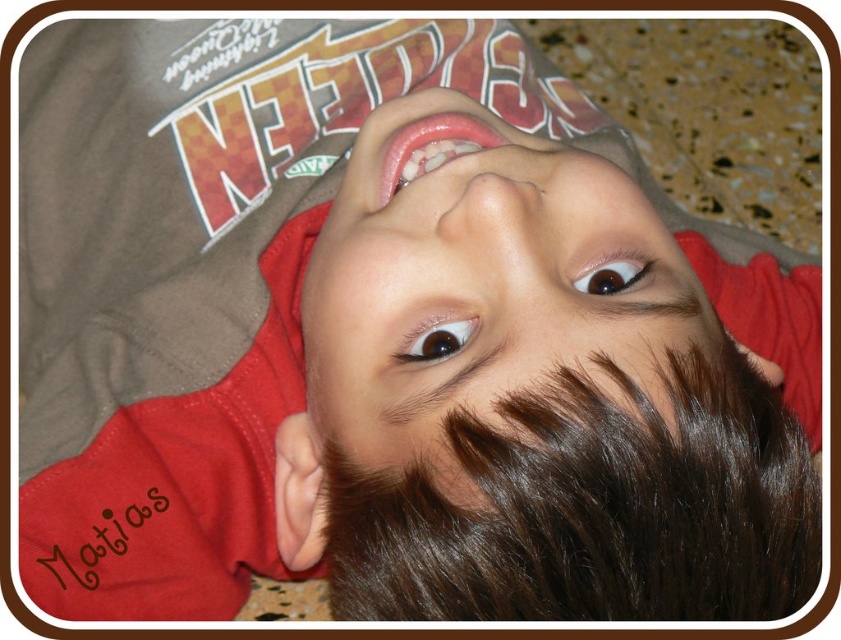
Is smooth skin face at center below brown shiny eye at upper center?

Yes.

Can you confirm if smooth skin face at center is smaller than brown shiny eye at upper center?

No.

Between point (504, 428) and point (617, 284), which one is positioned behind?

Positioned behind is point (617, 284).

Locate an element on the screen. This screenshot has height=640, width=841. smooth skin face at center is located at coordinates (477, 291).

Who is positioned more to the left, smooth skin face at center or brown glossy eye at center?

Positioned to the left is brown glossy eye at center.

Is smooth skin face at center below brown glossy eye at center?

Incorrect, smooth skin face at center is not positioned below brown glossy eye at center.

Does point (522, 385) lie behind point (419, 353)?

That is False.

Find the location of a particular element. The height and width of the screenshot is (640, 841). smooth skin face at center is located at coordinates [477, 291].

Who is taller, brown glossy eye at center or brown shiny eye at upper center?

brown shiny eye at upper center is taller.

Is brown glossy eye at center in front of brown shiny eye at upper center?

Yes.

What do you see at coordinates (436, 339) in the screenshot? Image resolution: width=841 pixels, height=640 pixels. I see `brown glossy eye at center` at bounding box center [436, 339].

Where is `brown glossy eye at center`? brown glossy eye at center is located at coordinates (436, 339).